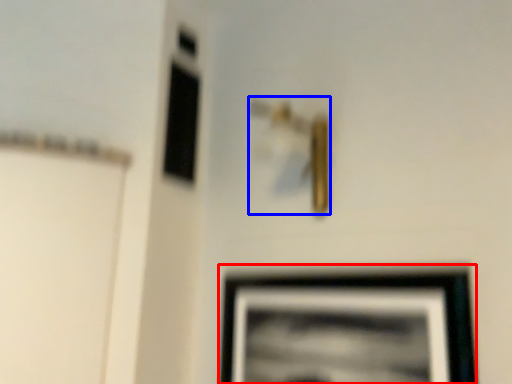
Question: Which point is further to the camera, picture frame (highlighted by a red box) or door handle (highlighted by a blue box)?

Choices:
 (A) picture frame
 (B) door handle

Answer: (B)